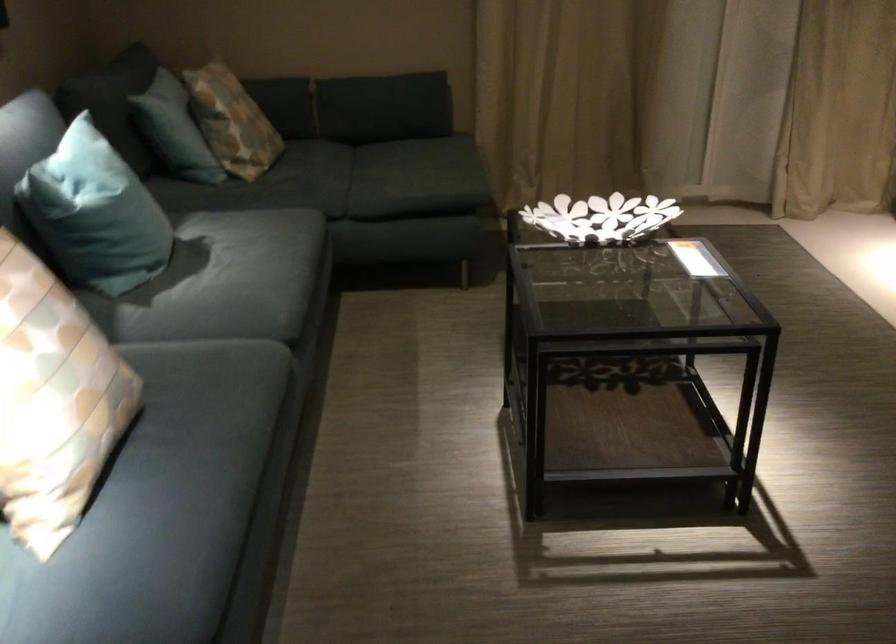
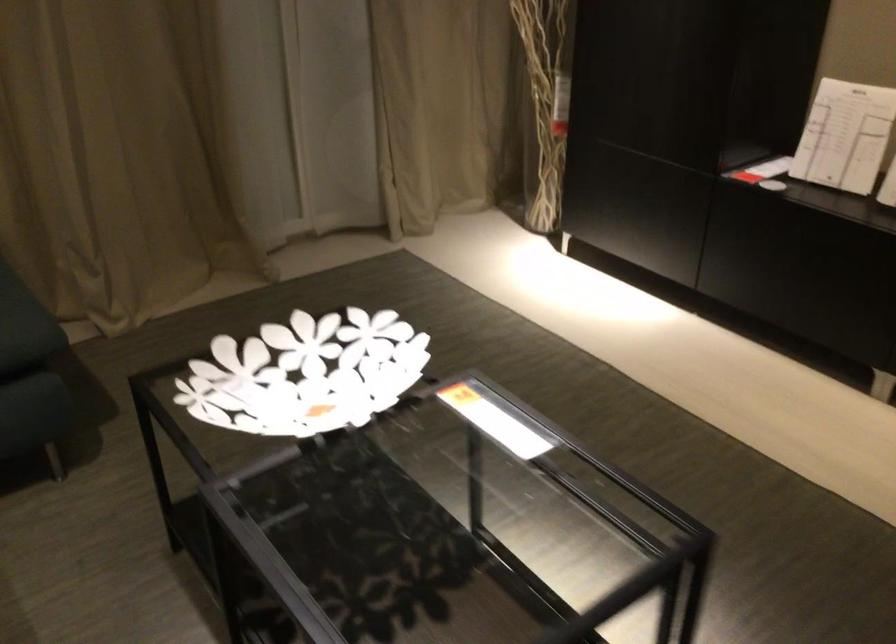
Question: Based on the continuous images, in which direction is the camera rotating? Reply with the corresponding letter.

Choices:
 (A) Left
 (B) Right
 (C) Up
 (D) Down

Answer: (B)